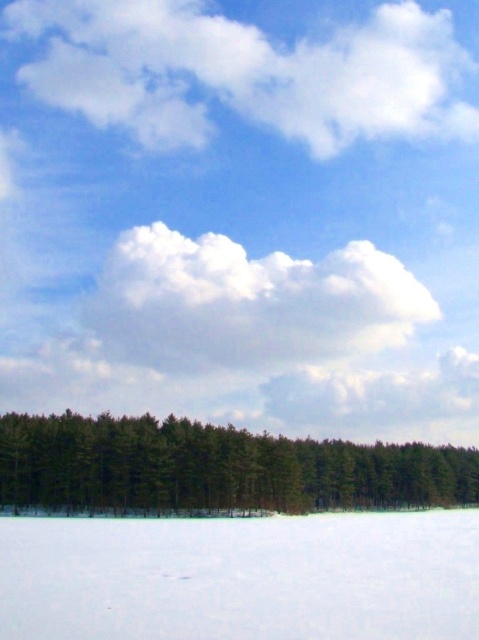
Question: Observing the image, what is the correct spatial positioning of white fluffy cloud at upper center in reference to white fluffy cloud at center?

Choices:
 (A) above
 (B) below

Answer: (A)

Question: Estimate the real-world distances between objects in this image. Which object is closer to the white fluffy cloud at center?

Choices:
 (A) white powdery snow at lower center
 (B) white fluffy cloud at upper center

Answer: (B)

Question: Does white powdery snow at lower center appear on the left side of green matte trees at lower center?

Choices:
 (A) no
 (B) yes

Answer: (B)

Question: Which object is the closest to the white fluffy cloud at center?

Choices:
 (A) white powdery snow at lower center
 (B) green matte trees at lower center

Answer: (B)

Question: Is white powdery snow at lower center wider than white fluffy cloud at center?

Choices:
 (A) yes
 (B) no

Answer: (B)

Question: Which point is farther to the camera?

Choices:
 (A) white fluffy cloud at center
 (B) green matte trees at lower center

Answer: (A)